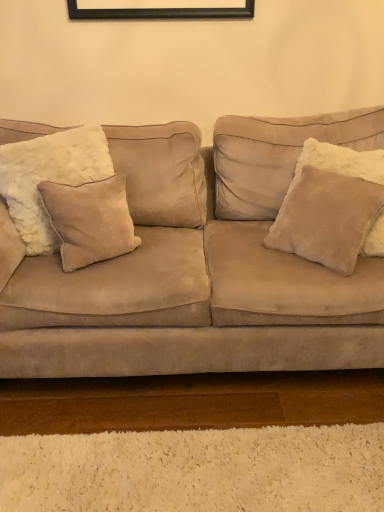
Question: Considering their positions, is beige suede pillow at left, which ranks as the second pillow in left-to-right order, located in front of or behind beige suede pillow at left, marked as the 1th pillow in a left-to-right arrangement?

Choices:
 (A) front
 (B) behind

Answer: (B)

Question: From the image's perspective, is beige suede pillow at left, which is the second pillow in right-to-left order, located above or below beige suede pillow at left, the 3th pillow viewed from the right?

Choices:
 (A) below
 (B) above

Answer: (A)

Question: Which is farther from the beige suede pillow at left, the 3th pillow viewed from the right?

Choices:
 (A) suede couch at center
 (B) beige suede pillow at left, which is the second pillow in right-to-left order
 (C) suede pillow at right, positioned as the 3th pillow in left-to-right order

Answer: (C)

Question: Which of these objects is positioned farthest from the beige suede pillow at left, marked as the 1th pillow in a left-to-right arrangement?

Choices:
 (A) beige suede pillow at left, which is the second pillow in right-to-left order
 (B) suede pillow at right, the 1th pillow in the right-to-left sequence
 (C) suede couch at center

Answer: (B)